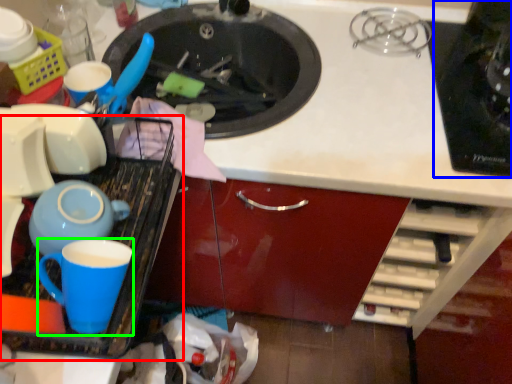
Question: Which object is the farthest from kitchen appliance (highlighted by a red box)? Choose among these: appliance (highlighted by a blue box) or coffee cup (highlighted by a green box).

Choices:
 (A) appliance
 (B) coffee cup

Answer: (A)